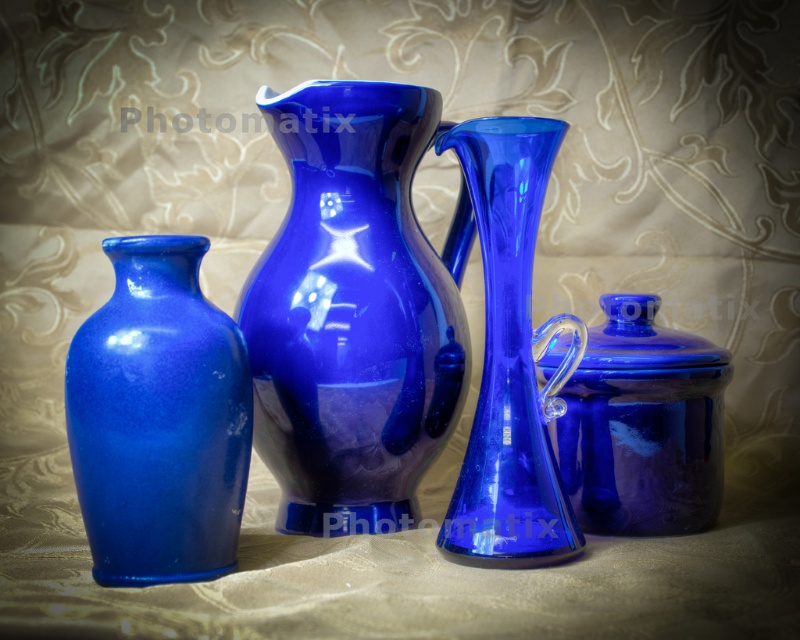
Question: Is glossy ceramic jug at center further to the viewer compared to glossy glass vase at center?

Choices:
 (A) no
 (B) yes

Answer: (B)

Question: Which of these objects is positioned closest to the glossy glass vase at center?

Choices:
 (A) glossy ceramic jug at center
 (B) glossy ceramic vase at left

Answer: (A)

Question: Does glossy ceramic jug at center appear under glossy cobalt blue jar at right?

Choices:
 (A) yes
 (B) no

Answer: (B)

Question: Which of the following is the farthest from the observer?

Choices:
 (A) (202, 536)
 (B) (509, 292)
 (C) (320, 448)
 (D) (604, 380)

Answer: (D)

Question: Which point is farther to the camera?

Choices:
 (A) glossy ceramic jug at center
 (B) glossy ceramic vase at left
 (C) glossy glass vase at center
 (D) glossy cobalt blue jar at right

Answer: (D)

Question: Is glossy ceramic vase at left above glossy glass vase at center?

Choices:
 (A) no
 (B) yes

Answer: (A)